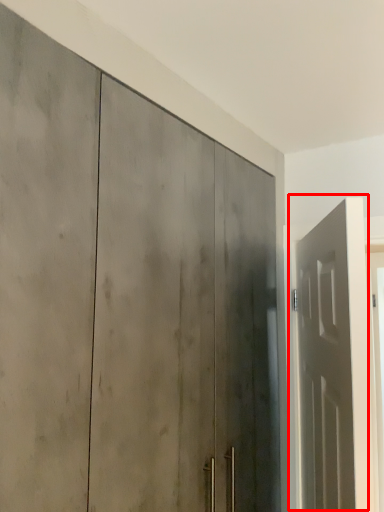
Question: From the image's perspective, where is door (annotated by the red box) located relative to door?

Choices:
 (A) above
 (B) below

Answer: (B)